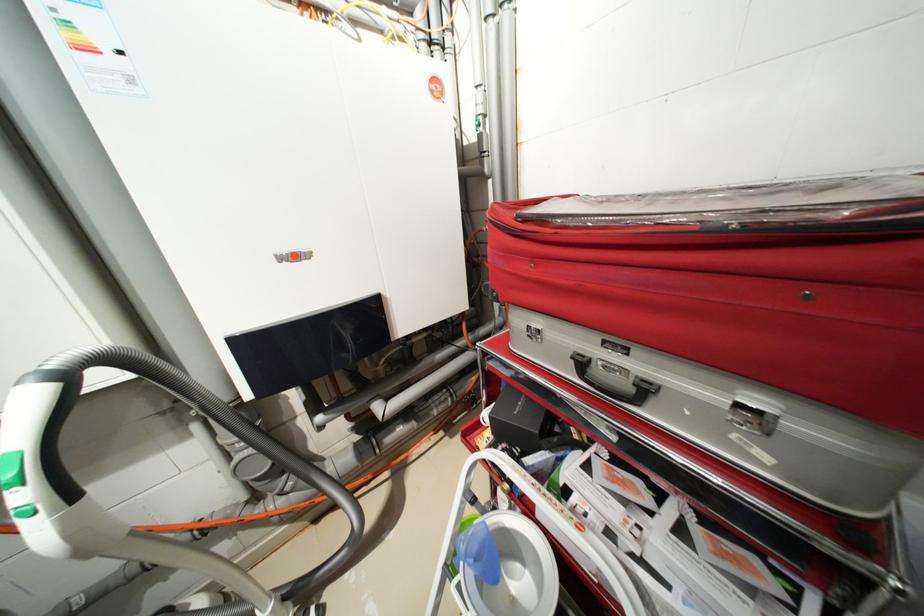
Describe the element at coordinates (42, 464) in the screenshot. Image resolution: width=924 pixels, height=616 pixels. I see `the vacuum cleaner handle` at that location.